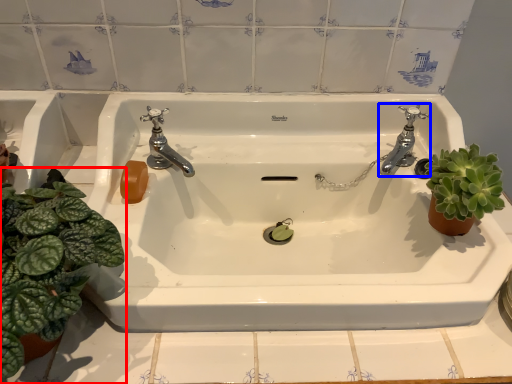
Question: Among these objects, which one is farthest to the camera, houseplant (highlighted by a red box) or tap (highlighted by a blue box)?

Choices:
 (A) houseplant
 (B) tap

Answer: (B)